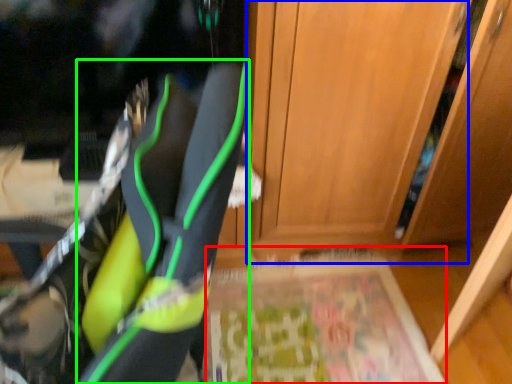
Question: Which object is positioned closest to yoga mat (highlighted by a red box)? Select from door (highlighted by a blue box) and footwear (highlighted by a green box).

Choices:
 (A) door
 (B) footwear

Answer: (A)